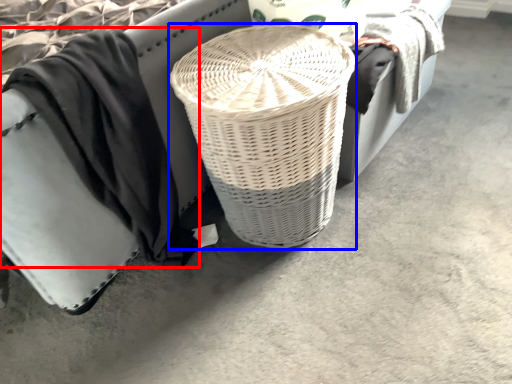
Question: Among these objects, which one is nearest to the camera, clothing (highlighted by a red box) or basket (highlighted by a blue box)?

Choices:
 (A) clothing
 (B) basket

Answer: (A)